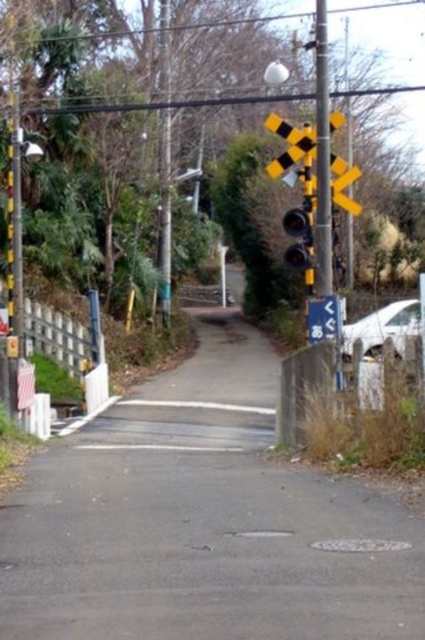
Can you confirm if asphalt road at center is smaller than metallic traffic light at center?

No, asphalt road at center is not smaller than metallic traffic light at center.

Is asphalt road at center positioned at the back of metallic traffic light at center?

No, asphalt road at center is closer to the viewer.

Locate an element on the screen. The height and width of the screenshot is (640, 425). asphalt road at center is located at coordinates (203, 522).

Find the location of a particular element. This screenshot has height=640, width=425. asphalt road at center is located at coordinates (203, 522).

Is metallic traffic light at center to the left of blue plastic sign at center from the viewer's perspective?

Yes, metallic traffic light at center is to the left of blue plastic sign at center.

Does metallic traffic light at center have a lesser height compared to blue plastic sign at center?

In fact, metallic traffic light at center may be taller than blue plastic sign at center.

At what (x,y) coordinates should I click in order to perform the action: click on metallic traffic light at center. Please return your answer as a coordinate pair (x, y). Looking at the image, I should click on (299, 237).

The height and width of the screenshot is (640, 425). In order to click on metallic traffic light at center in this screenshot , I will do `click(299, 237)`.

Between asphalt road at center and blue plastic sign at center, which one has less height?

asphalt road at center is shorter.

Is asphalt road at center taller than blue plastic sign at center?

No.

Is point (146, 538) behind point (334, 314)?

No, it is not.

I want to click on asphalt road at center, so click(x=203, y=522).